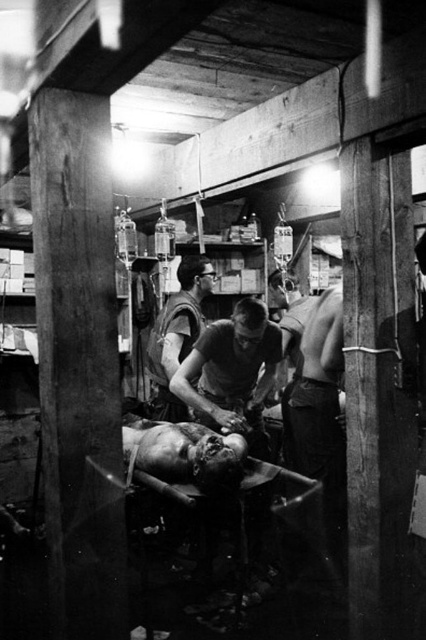
Consider the image. You are a medical assistant in this historical setting. You need to place a medical kit between the smooth skin man at center and the matte black vest at center. Given their widths, which object should the kit be placed closer to for stability?

The medical kit should be placed closer to the matte black vest at center because the smooth skin man at center is narrower than the matte black vest at center, making the vest a more stable base for placement.

Based on the scene description, which object is smaller in size between the smooth skin man at center and the matte black vest at center?

The smooth skin man at center is smaller in size compared to the matte black vest at center according to the description.

Based on the photo, in the historical medical setting shown, there is a smooth skin man at center and a matte black vest at center. Which object is taller?

The smooth skin man at center is taller than the matte black vest at center.